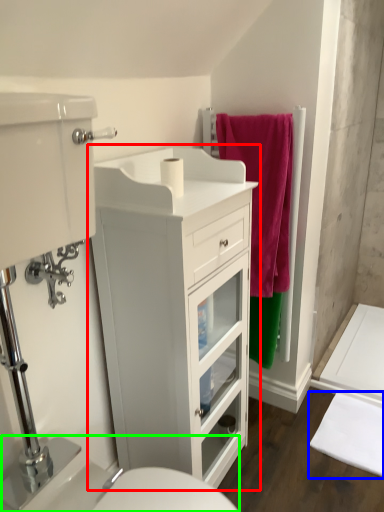
Question: Which object is the farthest from bathroom cabinet (highlighted by a red box)? Choose among these: bath mat (highlighted by a blue box) or sink (highlighted by a green box).

Choices:
 (A) bath mat
 (B) sink

Answer: (A)